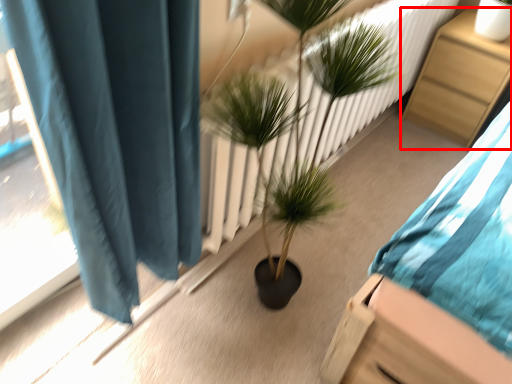
Question: Considering the relative positions of furniture (annotated by the red box) and houseplant in the image provided, where is furniture (annotated by the red box) located with respect to the staircase?

Choices:
 (A) left
 (B) right

Answer: (B)